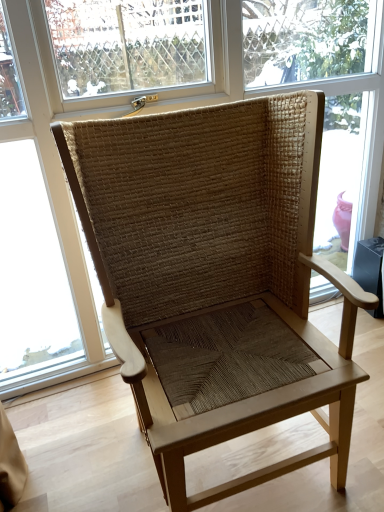
Where is `free spot to the left of natural woven chair at center`? The image size is (384, 512). free spot to the left of natural woven chair at center is located at coordinates (78, 439).